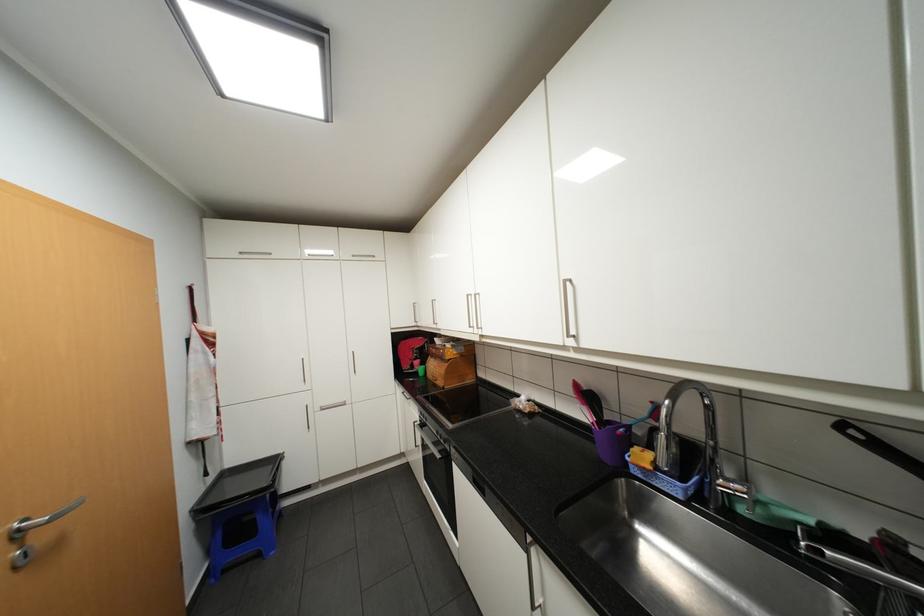
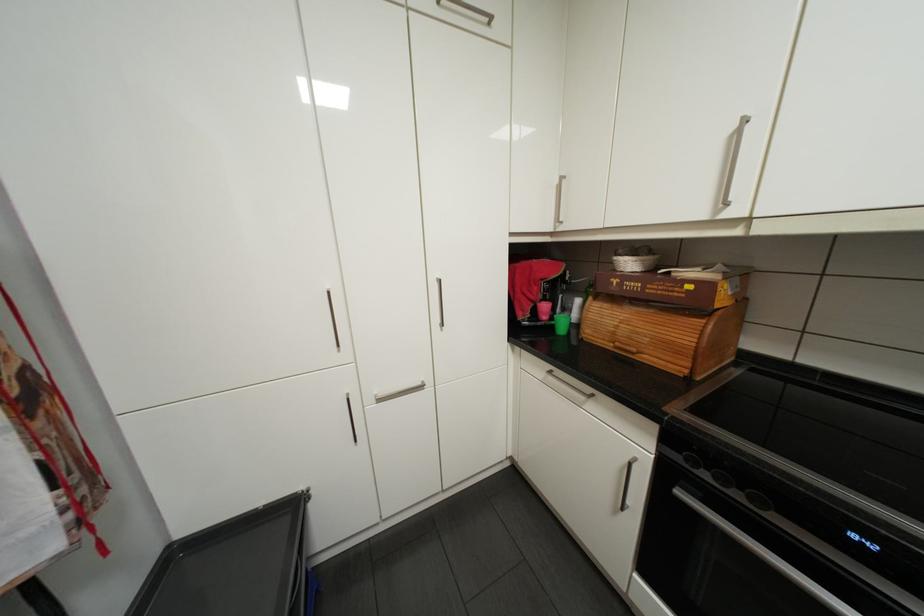
Where in the second image is the point corresponding to (440,355) from the first image?

(602, 297)